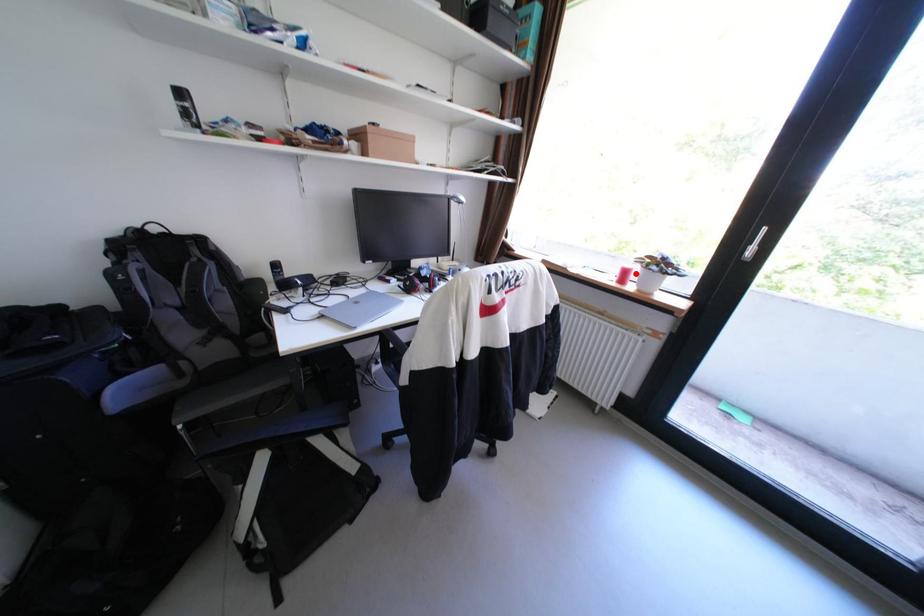
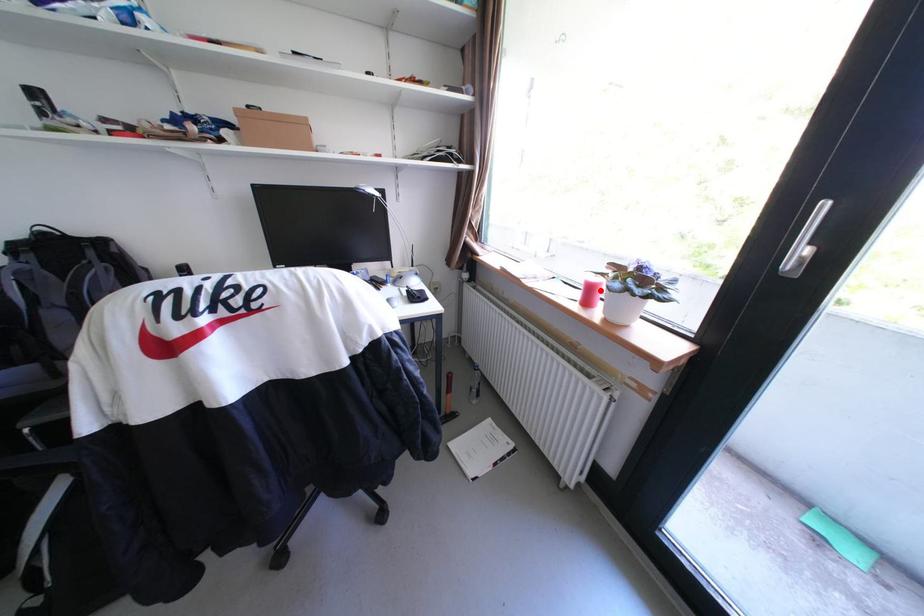
I am providing you with two images of the same scene from different viewpoints. A red point is marked on the first image and another point is marked on the second image. Is the marked point in image1 the same physical position as the marked point in image2?

Yes